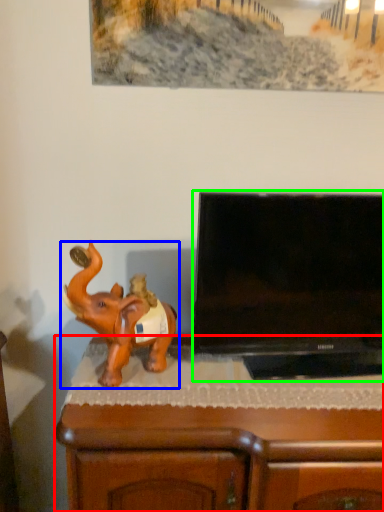
Question: Considering the real-world distances, which object is closest to furniture (highlighted by a red box)? elephant (highlighted by a blue box) or television (highlighted by a green box).

Choices:
 (A) elephant
 (B) television

Answer: (A)